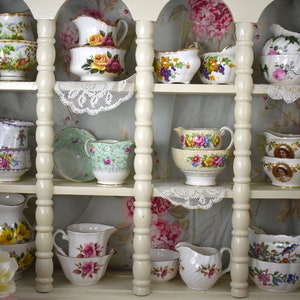
Identify the location of cups stacked in other cups. This screenshot has width=300, height=300. point(22,227), point(100,246), point(262,251), point(280,141), point(207,139), point(17,135), point(15,29), point(98,27), point(285,44).